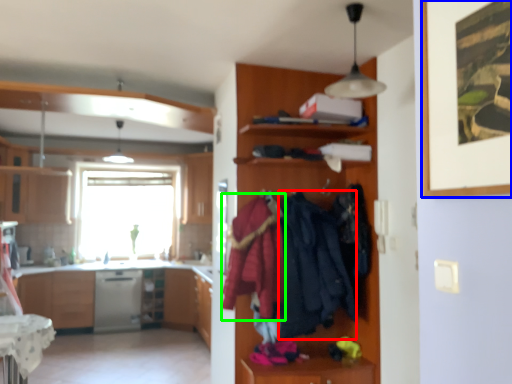
Question: Considering the real-world distances, which object is farthest from clothing (highlighted by a red box)? picture frame (highlighted by a blue box) or clothing (highlighted by a green box)?

Choices:
 (A) picture frame
 (B) clothing

Answer: (A)